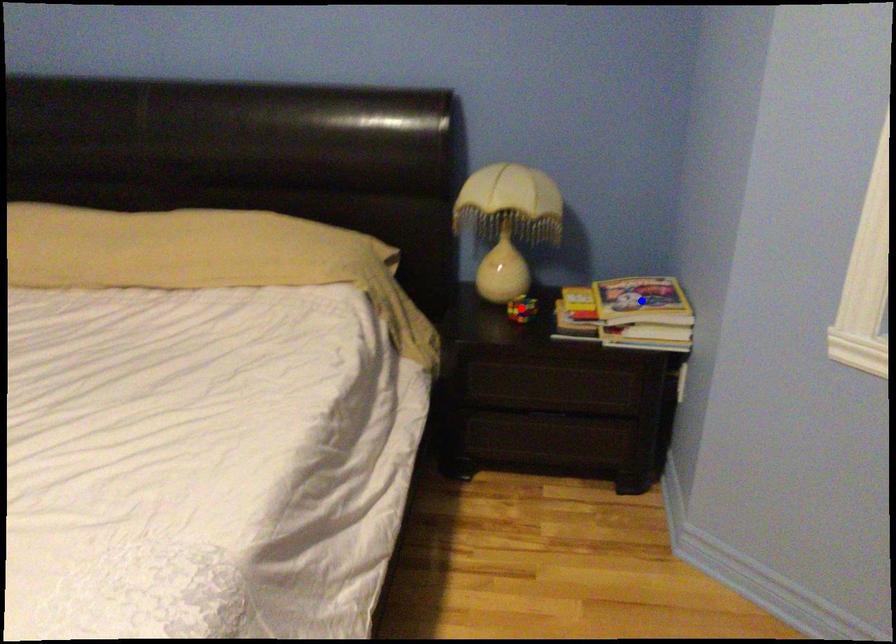
Question: In the image, two points are highlighted. Which point is nearer to the camera? Reply with the corresponding letter.

Choices:
 (A) blue point
 (B) red point

Answer: (A)